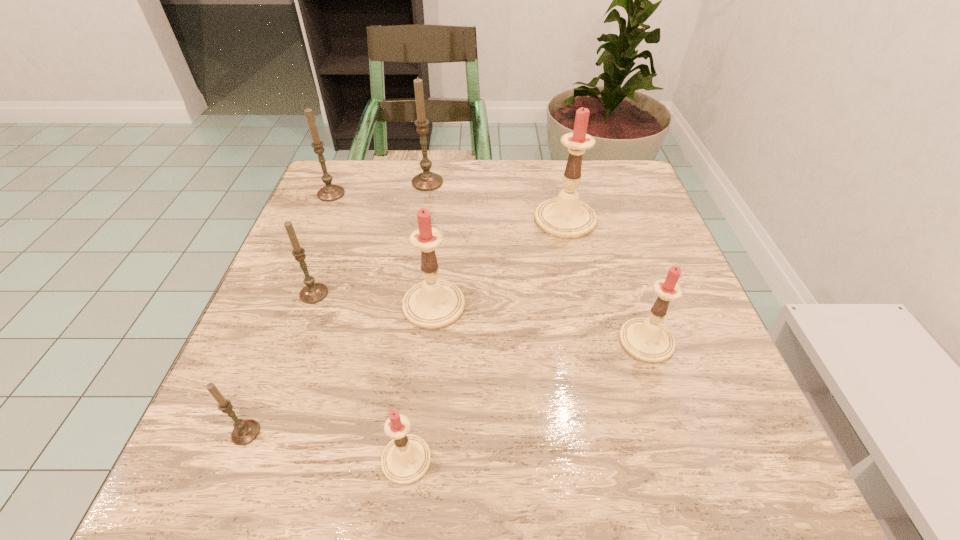
Select which gray candle is the fourth closest to the second smallest red candle. Please provide its 2D coordinates. Your answer should be formatted as a tuple, i.e. [(x, y)], where the tuple contains the x and y coordinates of a point satisfying the conditions above.

[(330, 192)]

Where is `red candle object that ranks as the third closest to the third biggest red candle`? This screenshot has height=540, width=960. red candle object that ranks as the third closest to the third biggest red candle is located at coordinates 405,459.

At what (x,y) coordinates should I click in order to perform the action: click on red candle that stands as the third closest to the third smallest gray candle. Please return your answer as a coordinate pair (x, y). This screenshot has width=960, height=540. Looking at the image, I should click on (405, 459).